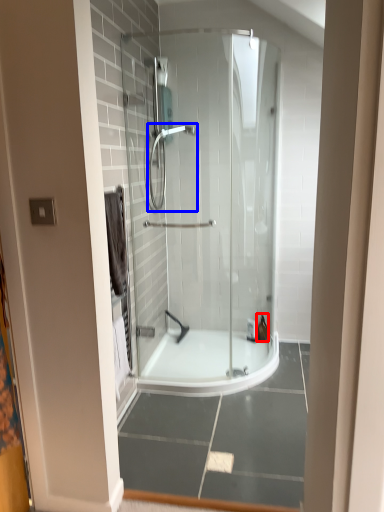
Question: Which object is further to the camera taking this photo, toiletry (highlighted by a red box) or shower (highlighted by a blue box)?

Choices:
 (A) toiletry
 (B) shower

Answer: (A)